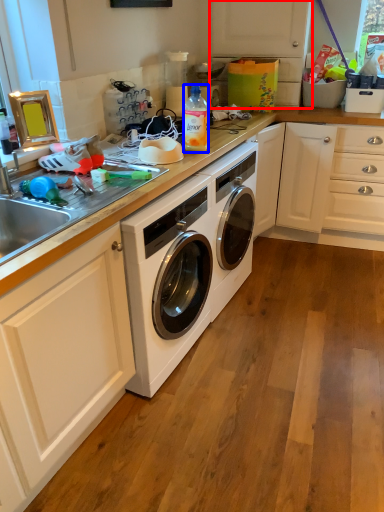
Question: Among these objects, which one is farthest to the camera, cabinetry (highlighted by a red box) or bottle (highlighted by a blue box)?

Choices:
 (A) cabinetry
 (B) bottle

Answer: (A)